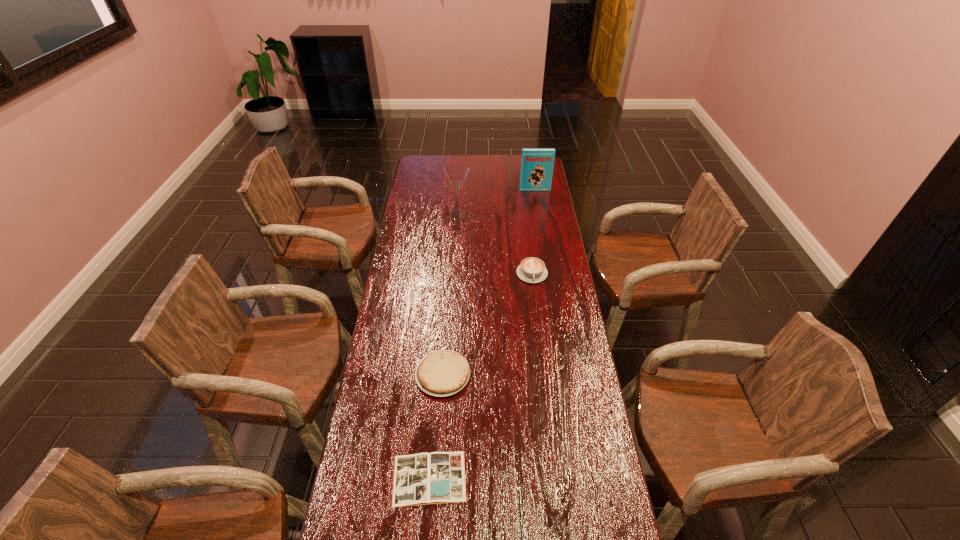
The height and width of the screenshot is (540, 960). In the image, there is a desktop. What are the coordinates of `vacant space at the right edge` in the screenshot? It's located at (564, 251).

Identify the location of free spot between the farther book and the third tallest object. The width and height of the screenshot is (960, 540). (534, 232).

Image resolution: width=960 pixels, height=540 pixels. What are the coordinates of `vacant region between the left book and the second farthest object` in the screenshot? It's located at (444, 347).

Where is `free space that is in between the flute glass and the nearest object`? The width and height of the screenshot is (960, 540). free space that is in between the flute glass and the nearest object is located at coordinates (444, 347).

Identify the location of empty space that is in between the left book and the tortilla. Image resolution: width=960 pixels, height=540 pixels. (436, 426).

This screenshot has height=540, width=960. Find the location of `vacant area that lies between the shorter book and the cappuccino`. vacant area that lies between the shorter book and the cappuccino is located at coordinates (481, 376).

You are a GUI agent. You are given a task and a screenshot of the screen. Output one action in this format:
    pyautogui.click(x=<x>, y=<y>)
    Task: Click on the free space between the second nearest object and the third nearest object
    
    Given the screenshot: What is the action you would take?
    pyautogui.click(x=488, y=324)

At what (x,y) coordinates should I click in order to perform the action: click on free spot between the nearest object and the fourth nearest object. Please return your answer as a coordinate pair (x, y). Looking at the image, I should click on (444, 347).

Find the location of a particular element. This screenshot has height=540, width=960. free area in between the cappuccino and the fourth tallest object is located at coordinates (488, 324).

At what (x,y) coordinates should I click in order to perform the action: click on empty location between the tortilla and the shorter book. Please return your answer as a coordinate pair (x, y). Looking at the image, I should click on (436, 426).